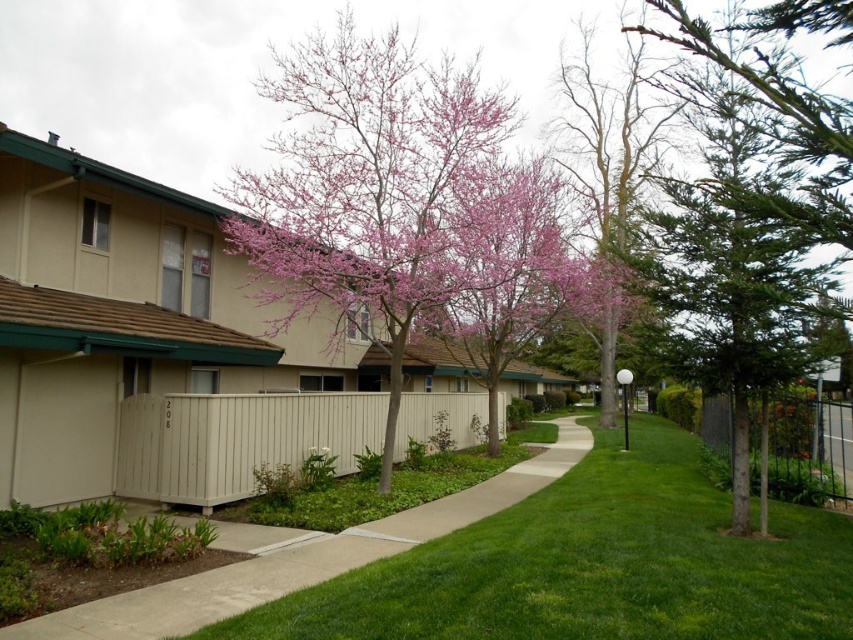
Is point (540, 458) closer to camera compared to point (793, 132)?

No, it is behind (793, 132).

Describe the element at coordinates (299, 556) in the screenshot. I see `smooth concrete sidewalk at center` at that location.

Find the location of `smooth concrete sidewalk at center`. smooth concrete sidewalk at center is located at coordinates (299, 556).

Looking at this image, between pink bloom tree at center and beige wood fence at center, which one appears on the right side from the viewer's perspective?

pink bloom tree at center is more to the right.

Does pink bloom tree at center have a greater width compared to beige wood fence at center?

Yes, pink bloom tree at center is wider than beige wood fence at center.

Image resolution: width=853 pixels, height=640 pixels. What are the coordinates of `pink bloom tree at center` in the screenshot? It's located at (403, 204).

Does beige wood fence at center have a greater width compared to metallic silver fence at right?

Indeed, beige wood fence at center has a greater width compared to metallic silver fence at right.

Does beige wood fence at center have a lesser height compared to metallic silver fence at right?

Incorrect, beige wood fence at center's height does not fall short of metallic silver fence at right's.

Is point (126, 451) more distant than point (791, 456)?

No, (126, 451) is closer to viewer.

Where is `beige wood fence at center`? The image size is (853, 640). beige wood fence at center is located at coordinates (236, 440).